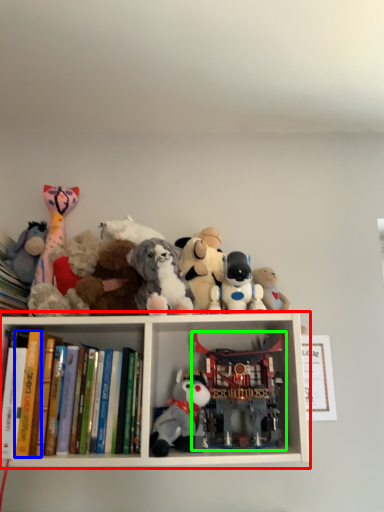
Question: Which object is the closest to the shelf (highlighted by a red box)? Choose among these: paperback book (highlighted by a blue box) or toy (highlighted by a green box).

Choices:
 (A) paperback book
 (B) toy

Answer: (B)